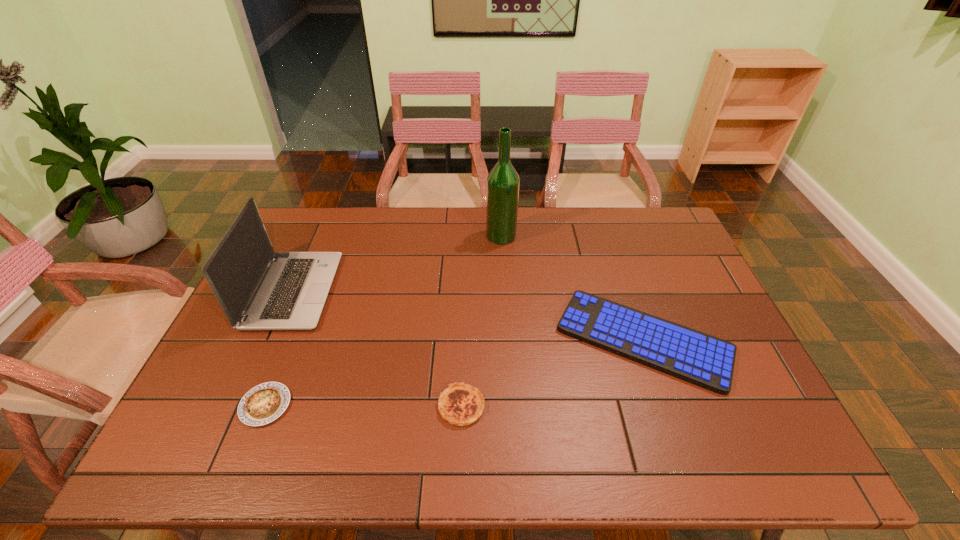
This screenshot has height=540, width=960. In the image, there is a desktop. In order to click on vacant space at the near right corner in this screenshot , I will do pyautogui.click(x=755, y=462).

Identify the location of free space between the third object from right to left and the left quiche. (364, 406).

Find the location of a particular element. The height and width of the screenshot is (540, 960). empty space between the rightmost object and the laptop computer is located at coordinates [468, 315].

Image resolution: width=960 pixels, height=540 pixels. Find the location of `vacant space that is in between the left quiche and the fourth shortest object`. vacant space that is in between the left quiche and the fourth shortest object is located at coordinates (279, 348).

I want to click on free space between the computer keyboard and the left quiche, so click(x=454, y=373).

Where is `free space between the computer keyboard and the laptop computer`? free space between the computer keyboard and the laptop computer is located at coordinates (468, 315).

Where is `free point between the left quiche and the computer keyboard`? This screenshot has height=540, width=960. free point between the left quiche and the computer keyboard is located at coordinates [454, 373].

At what (x,y) coordinates should I click in order to perform the action: click on vacant area that lies between the left quiche and the rightmost object. Please return your answer as a coordinate pair (x, y). This screenshot has width=960, height=540. Looking at the image, I should click on (454, 373).

At what (x,y) coordinates should I click in order to perform the action: click on free space that is in between the farthest object and the left quiche. Please return your answer as a coordinate pair (x, y). The width and height of the screenshot is (960, 540). Looking at the image, I should click on (383, 321).

Identify the location of free spot between the left quiche and the computer keyboard. The height and width of the screenshot is (540, 960). (454, 373).